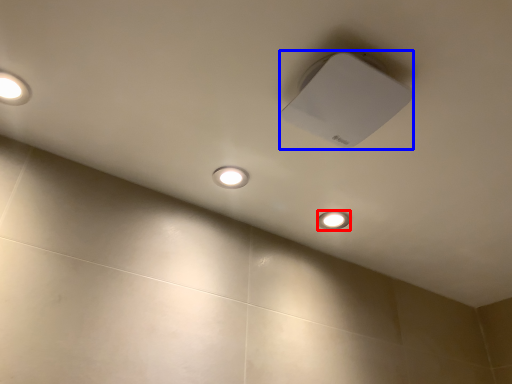
Question: Which point is closer to the camera, dot (highlighted by a red box) or lamp (highlighted by a blue box)?

Choices:
 (A) dot
 (B) lamp

Answer: (B)